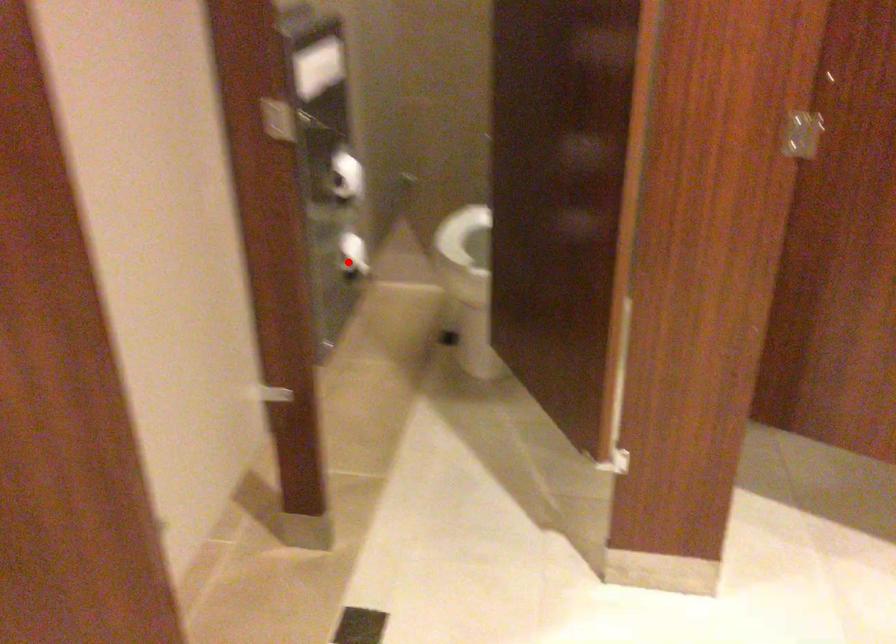
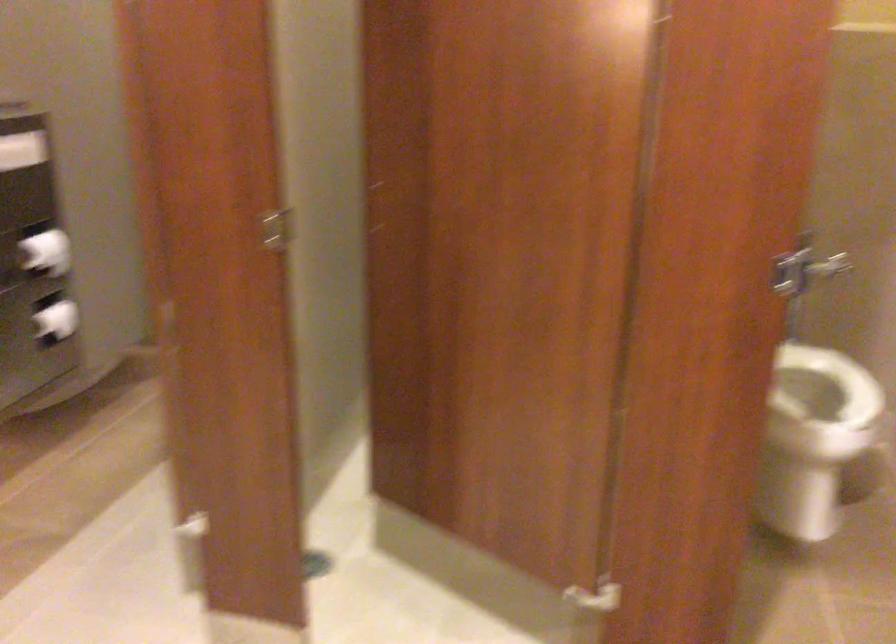
The point at the highlighted location is marked in the first image. Where is the corresponding point in the second image?

(56, 321)